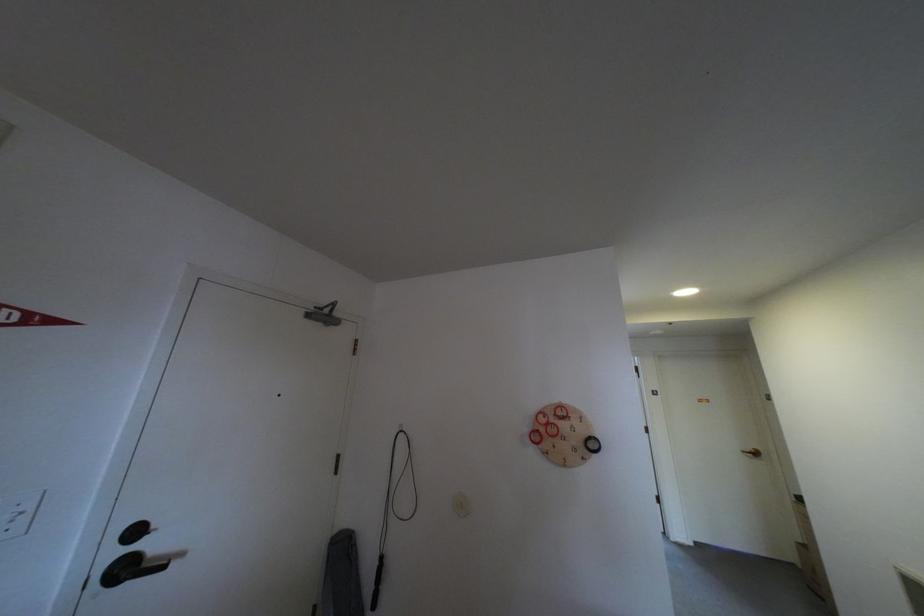
Describe the element at coordinates (131, 568) in the screenshot. I see `a black door handle` at that location.